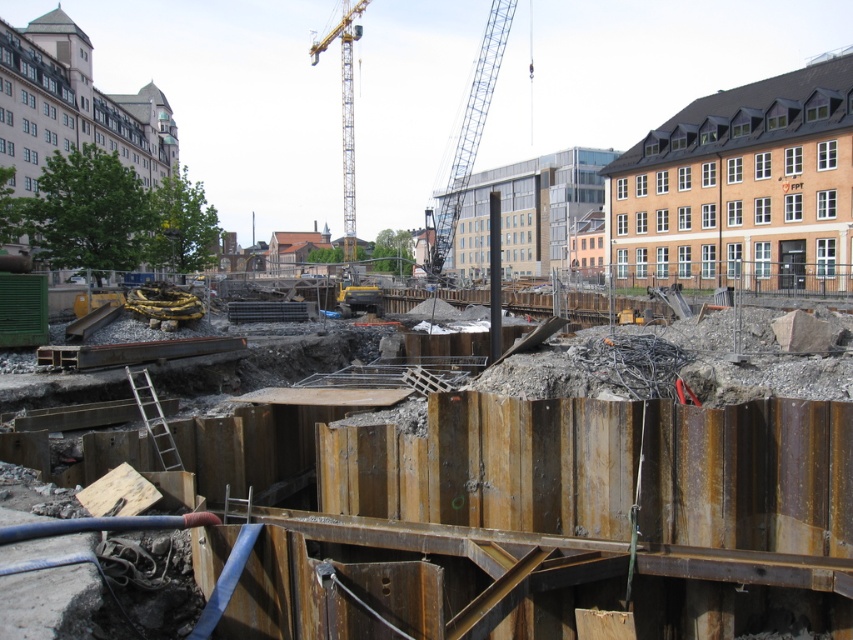
You are a construction worker who needs to determine which object is taller between the rusty metal sheet at center and the yellow metallic crane at upper center. Based on the scene, which one is taller?

The yellow metallic crane at upper center is taller than the rusty metal sheet at center.

You are a safety inspector at the construction site. You notice the rusty metal sheet at center and the blue metallic crane at center. Which object is shorter in height?

The rusty metal sheet at center is not as tall as the blue metallic crane at center, so the rusty metal sheet at center is shorter in height.